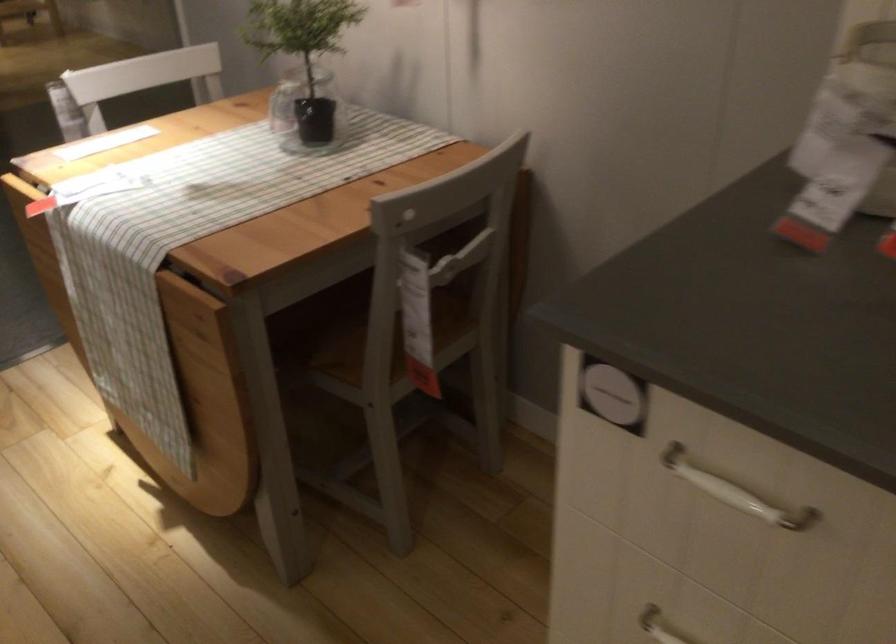
At what (x,y) coordinates should I click in order to perform the action: click on glass jar. Please return your answer as a coordinate pair (x, y). The image size is (896, 644). Looking at the image, I should click on click(x=307, y=111).